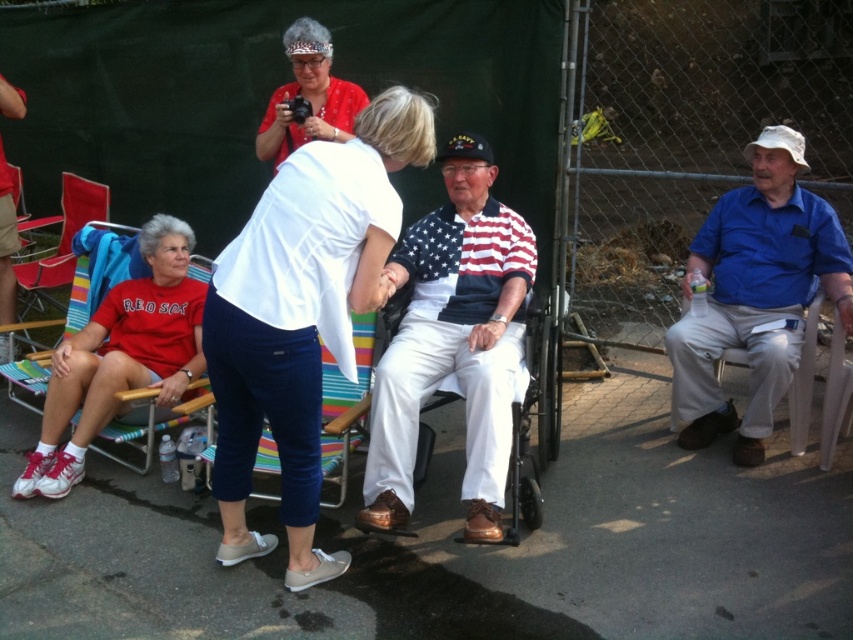
You are standing at the point labeled point (x=199, y=356) and want to move to the point labeled point (x=334, y=113). Which direction should you face to walk towards your destination?

You should face north to walk towards point (x=334, y=113) from point (x=199, y=356).

You are standing at the origin point in the image. There is a white matte red sox t shirt at lower left located at point (x=120, y=356). Can you tell me the coordinates of the white matte red sox t shirt at lower left?

The white matte red sox t shirt at lower left is located at point (x=120, y=356).